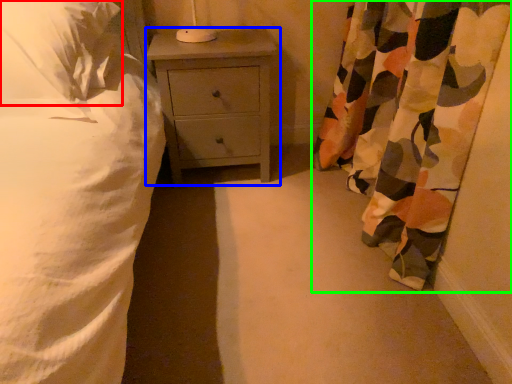
Question: Which object is positioned farthest from pillow (highlighted by a red box)? Select from nightstand (highlighted by a blue box) and curtain (highlighted by a green box).

Choices:
 (A) nightstand
 (B) curtain

Answer: (B)